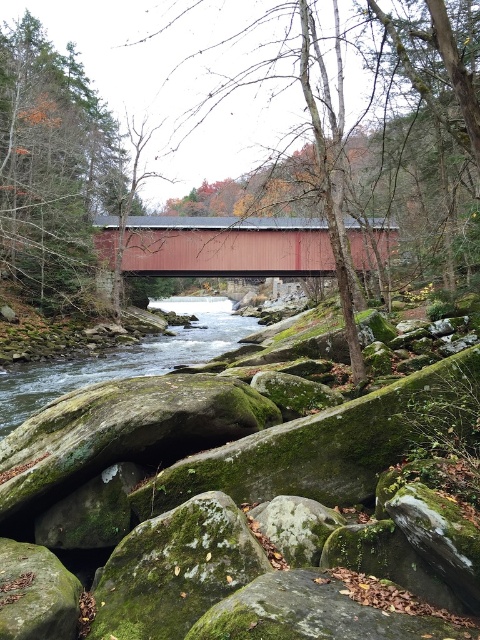
You are standing at the edge of the river and want to walk to the smooth bark tree at center. The path leads you past the matte red bridge at center first. How far will you have to walk from the bridge to the tree?

The matte red bridge at center is 22.31 feet away from the smooth bark tree at center, so you will have to walk 22.31 feet from the bridge to the tree.

You are standing at the center of the red covered bridge and want to reach the green mossy rock at left. Which direction should you walk to get there?

The green mossy rock at left is located at point (50, 163), which is to the left side of the bridge. You should walk towards the left direction from the center of the red covered bridge to reach it.